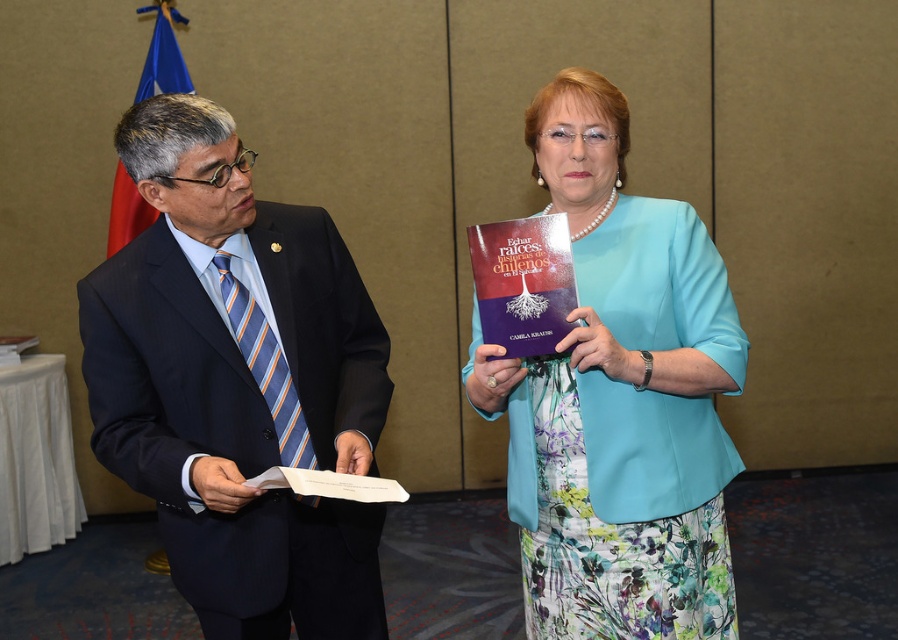
Question: Does dark blue suit at left have a lesser width compared to floral dress at center?

Choices:
 (A) yes
 (B) no

Answer: (B)

Question: Which of these objects is positioned closest to the dark blue suit at left?

Choices:
 (A) purple matte book at center
 (B) floral dress at center

Answer: (A)

Question: Does dark blue suit at left appear over floral dress at center?

Choices:
 (A) no
 (B) yes

Answer: (A)

Question: Which of the following is the farthest from the observer?

Choices:
 (A) floral dress at center
 (B) purple matte book at center

Answer: (B)

Question: Is floral dress at center to the left of purple matte book at center from the viewer's perspective?

Choices:
 (A) no
 (B) yes

Answer: (A)

Question: Which object is closer to the camera taking this photo?

Choices:
 (A) floral dress at center
 (B) dark blue suit at left

Answer: (B)